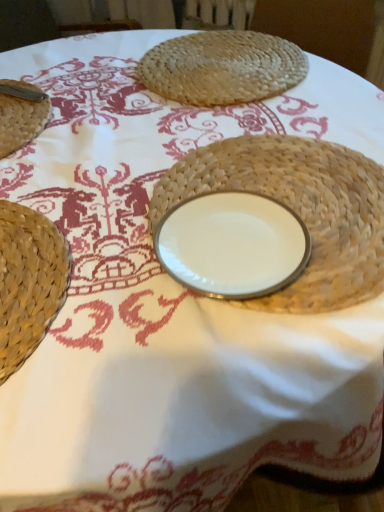
Where is `blank space above woven straw plate at center (from a real-world perspective)`? blank space above woven straw plate at center (from a real-world perspective) is located at coordinates (273, 211).